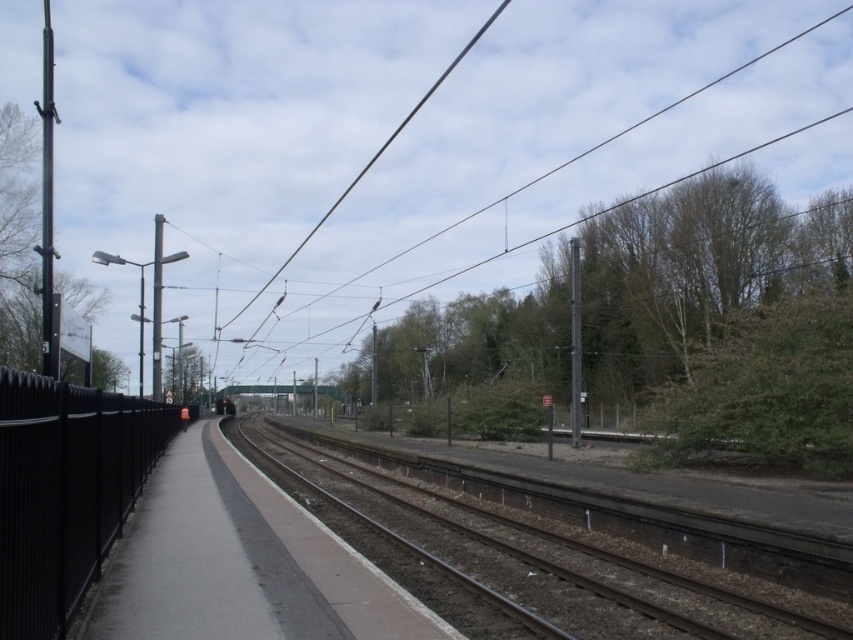
You are a maintenance worker on the platform. You need to check the distance between the brown gravel track at center and the black wire at upper center. Which one is closer to the platform edge?

The brown gravel track at center is closer to the platform edge than the black wire at upper center because it is shorter in height.

You are a maintenance worker on the platform. You need to inspect the brown gravel track at center and the black wire at upper center. Which object is positioned lower in the scene?

The brown gravel track at center is located below the black wire at upper center, so the brown gravel track at center is positioned lower in the scene.

You are standing on the platform at the railway station and want to find the brown gravel track at center. According to the coordinates provided, where should you look relative to your current position?

The brown gravel track at center is located at coordinates 0.873 on the x axis and 0.626 on the y axis, so you should look towards the right and slightly forward from your current position on the platform.